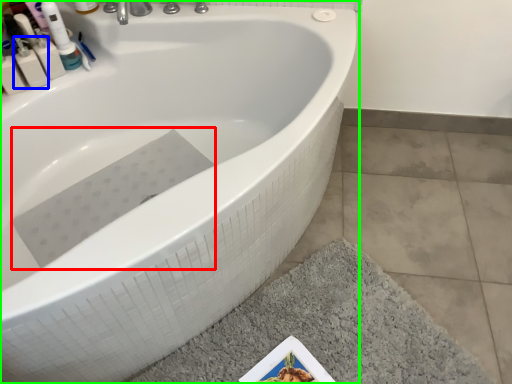
Question: Based on their relative distances, which object is nearer to bath towel (highlighted by a red box)? Choose from mouthwash (highlighted by a blue box) and bathtub (highlighted by a green box).

Choices:
 (A) mouthwash
 (B) bathtub

Answer: (B)